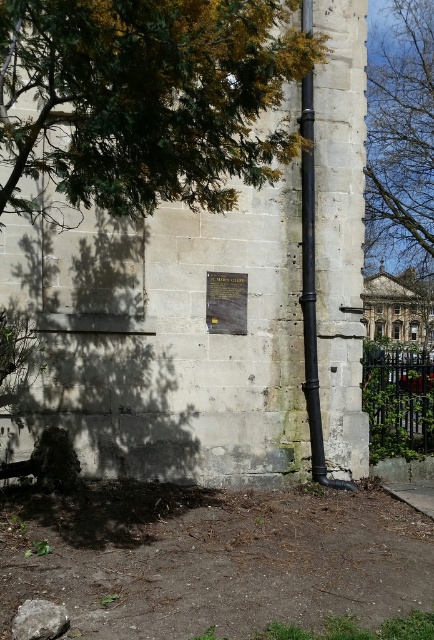
Question: Which object is positioned closest to the green leafy tree at upper left?

Choices:
 (A) green leafy tree at upper center
 (B) black matte pipe at right

Answer: (B)

Question: Does green leafy tree at upper center come in front of black metal fence at lower right?

Choices:
 (A) yes
 (B) no

Answer: (B)

Question: Which is farther from the smooth stone pillar at right?

Choices:
 (A) matte brown stone plaque at center
 (B) black metal fence at lower right
 (C) green leafy tree at upper left

Answer: (C)

Question: Among these objects, which one is farthest from the camera?

Choices:
 (A) black matte pipe at right
 (B) green leafy tree at upper left
 (C) smooth stone pillar at right

Answer: (C)

Question: Is smooth stone pillar at right smaller than black matte pipe at right?

Choices:
 (A) yes
 (B) no

Answer: (B)

Question: Is black metal fence at lower right bigger than black matte pipe at right?

Choices:
 (A) yes
 (B) no

Answer: (A)